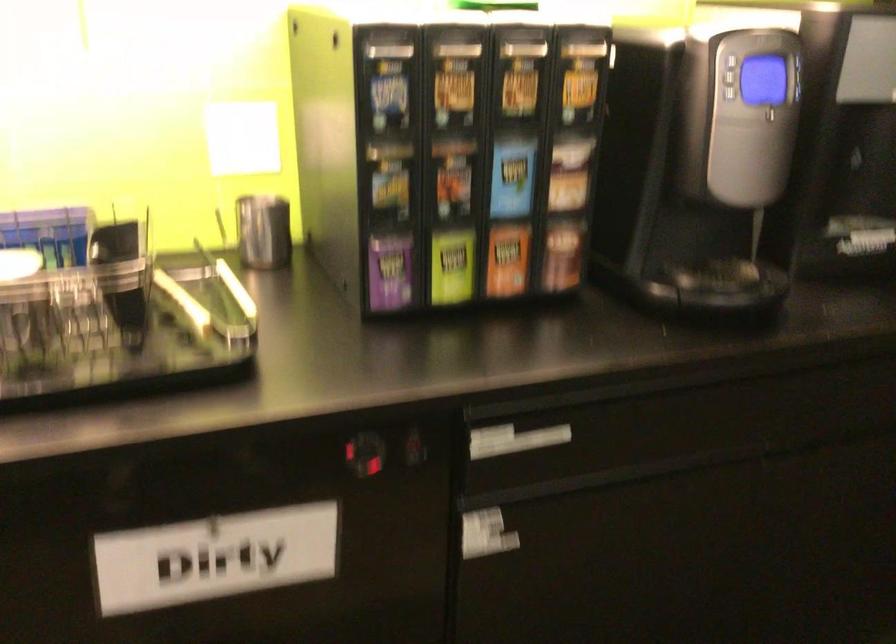
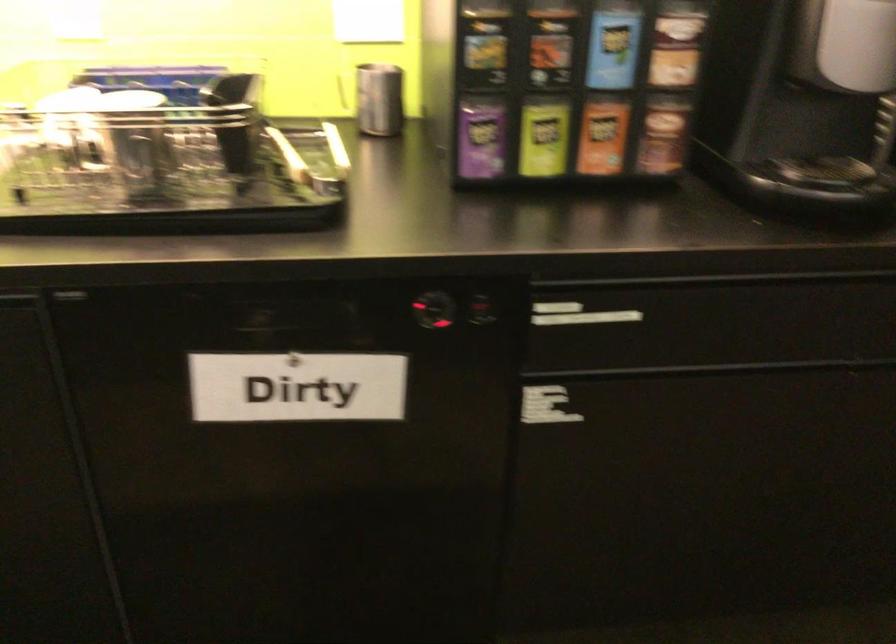
Question: The images are taken continuously from a first-person perspective. In which direction are you moving?

Choices:
 (A) Left
 (B) Right
 (C) Forward
 (D) Backward

Answer: (B)